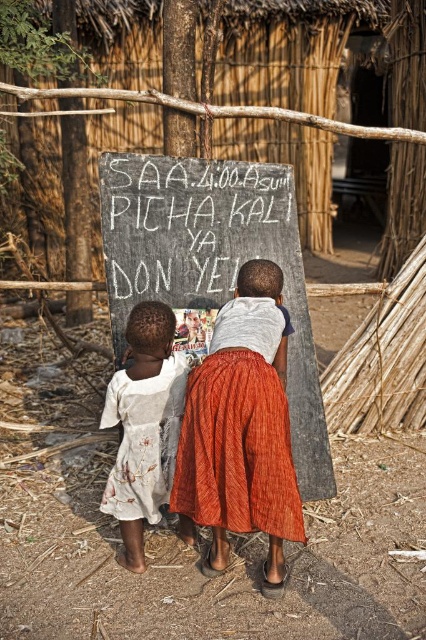
You are a photographer trying to capture both the orange textured skirt at center and the white chalkboard at center in a single frame. Which object should you focus on first if you want to ensure both are in focus?

The orange textured skirt at center is thinner than the white chalkboard at center, so focusing on the white chalkboard at center first will help ensure both are in focus since it is larger and occupies more space in the frame.

You are a photographer trying to capture a clear shot of the chalkboard. There are two children blocking your view. The orange textured skirt at center and the white printed dress at lower left are in the way. Which child should you ask to step aside so you can see the chalkboard better?

The orange textured skirt at center is in front of the white printed dress at lower left, so you should ask the child wearing the orange textured skirt at center to step aside to get a clearer view of the chalkboard.

You are a photographer trying to capture both the orange textured skirt at center and the white printed dress at lower left in a single frame. Based on their positions, which direction should you move your camera to include both subjects?

To include both the orange textured skirt at center and the white printed dress at lower left in the frame, you should move your camera to the left since the orange textured skirt at center is to the right of the white printed dress at lower left.